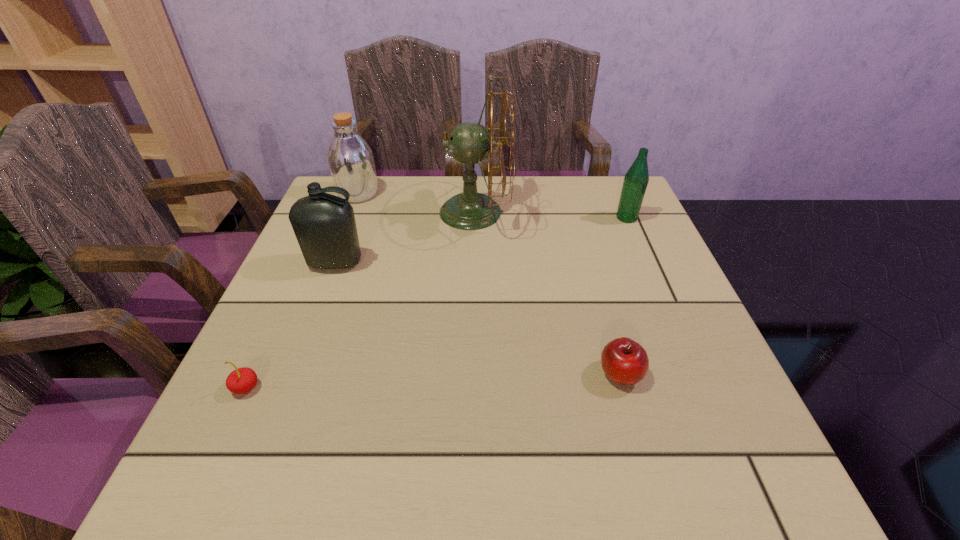
This screenshot has width=960, height=540. Find the location of `vacant space located 0.230m on the back of the third nearest object`. vacant space located 0.230m on the back of the third nearest object is located at coordinates (359, 199).

The height and width of the screenshot is (540, 960). What are the coordinates of `free region located on the left of the rightmost object` in the screenshot? It's located at (523, 218).

The height and width of the screenshot is (540, 960). Identify the location of free region located 0.280m on the left of the apple. (442, 374).

The width and height of the screenshot is (960, 540). Find the location of `vacant space situated on the front of the cherry`. vacant space situated on the front of the cherry is located at coordinates (220, 444).

Identify the location of fan located in the far edge section of the desktop. (470, 210).

At what (x,y) coordinates should I click in order to perform the action: click on cherry positioned at the left edge. Please return your answer as a coordinate pair (x, y). Looking at the image, I should click on (242, 380).

The image size is (960, 540). Identify the location of bottle located at the right edge. (636, 179).

At what (x,y) coordinates should I click in order to perform the action: click on apple located in the right edge section of the desktop. Please return your answer as a coordinate pair (x, y). The height and width of the screenshot is (540, 960). Looking at the image, I should click on (624, 361).

This screenshot has height=540, width=960. I want to click on object situated at the far left corner, so click(350, 158).

The height and width of the screenshot is (540, 960). Identify the location of object located at the far right corner. (636, 179).